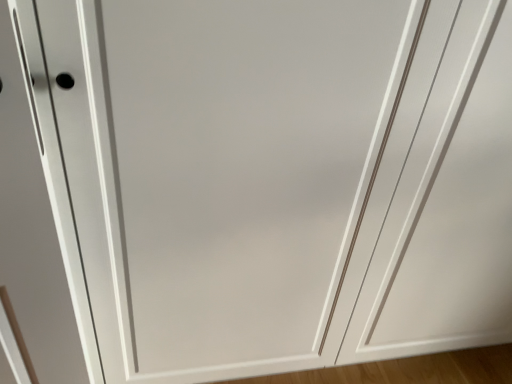
This screenshot has width=512, height=384. Describe the element at coordinates (41, 220) in the screenshot. I see `white matte screen door at left` at that location.

Locate an element on the screen. Image resolution: width=512 pixels, height=384 pixels. white matte screen door at left is located at coordinates (41, 220).

Where is `white matte screen door at left`? white matte screen door at left is located at coordinates (41, 220).